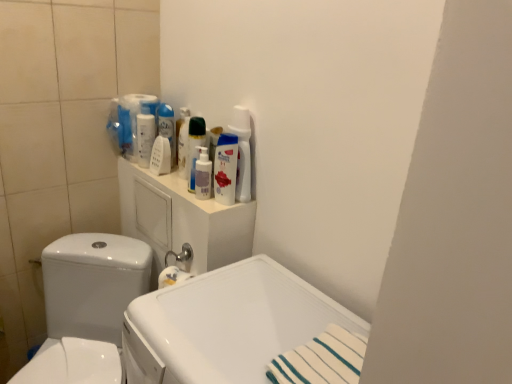
Describe the element at coordinates (194, 147) in the screenshot. I see `translucent plastic pump bottle at center, which is the 3th cleaning product from left to right` at that location.

Identify the location of white glossy bottle at upper center, acting as the fourth cleaning product starting from the left. This screenshot has height=384, width=512. (225, 168).

This screenshot has width=512, height=384. What do you see at coordinates (183, 147) in the screenshot?
I see `white glossy bottle at upper center, the 3th cleaning product viewed from the right` at bounding box center [183, 147].

Locate an element on the screen. The height and width of the screenshot is (384, 512). white glossy mouthwash at upper center, which appears as the second mouthwash when viewed from the front is located at coordinates (145, 138).

Based on the photo, is white glossy sink at center smaller than white plastic medicine cabinet at upper center?

No.

What's the angular difference between white glossy sink at center and white plastic medicine cabinet at upper center's facing directions?

They differ by 0.959 degrees in their facing directions.

Between point (180, 364) and point (165, 227), which one is positioned behind?

The point (165, 227) is behind.

Find the location of a particular element. This screenshot has height=384, width=512. sink that appears in front of the white plastic medicine cabinet at upper center is located at coordinates (226, 324).

Between semi-glossy white bottle at upper center, positioned as the second mouthwash in left-to-right order, and white glossy toilet at left, which one has smaller size?

semi-glossy white bottle at upper center, positioned as the second mouthwash in left-to-right order, is smaller.

From a real-world perspective, between semi-glossy white bottle at upper center, positioned as the second mouthwash in left-to-right order, and white glossy toilet at left, who is vertically lower?

white glossy toilet at left.

How much distance is there between semi-glossy white bottle at upper center, which appears as the 1th mouthwash when viewed from the right, and white glossy toilet at left?

A distance of 53.44 centimeters exists between semi-glossy white bottle at upper center, which appears as the 1th mouthwash when viewed from the right, and white glossy toilet at left.

Based on the photo, is semi-glossy white bottle at upper center, which appears as the 1th mouthwash when viewed from the right, thinner than white glossy toilet at left?

Yes, semi-glossy white bottle at upper center, which appears as the 1th mouthwash when viewed from the right, is thinner than white glossy toilet at left.

This screenshot has width=512, height=384. Identify the location of toilet that is on the left side of white glossy sink at center. pyautogui.click(x=87, y=306).

Considering the points (77, 298) and (262, 315), which point is behind, point (77, 298) or point (262, 315)?

The point (77, 298) is farther from the camera.

Is white glossy sink at center located within white glossy toilet at left?

Actually, white glossy sink at center is outside white glossy toilet at left.

Can you tell me how much white glossy toilet at left and white glossy bottle at upper center, acting as the 2th cleaning product starting from the left, differ in facing direction?

The angle between the facing direction of white glossy toilet at left and the facing direction of white glossy bottle at upper center, acting as the 2th cleaning product starting from the left, is 42.4 degrees.

Which object is positioned more to the right, white glossy toilet at left or white glossy bottle at upper center, acting as the 2th cleaning product starting from the left?

white glossy bottle at upper center, acting as the 2th cleaning product starting from the left, is more to the right.

From a real-world perspective, which object rests below the other?

white glossy toilet at left is physically lower.

Is white glossy toilet at left facing towards white glossy bottle at upper center, acting as the 2th cleaning product starting from the left?

No, white glossy toilet at left does not turn towards white glossy bottle at upper center, acting as the 2th cleaning product starting from the left.

From the picture: Which object is more forward, semi-glossy white bottle at upper center, which is the 2th mouthwash in back-to-front order, or white plastic medicine cabinet at upper center?

Positioned in front is white plastic medicine cabinet at upper center.

Would you say semi-glossy white bottle at upper center, the first mouthwash in the front-to-back sequence, is outside white plastic medicine cabinet at upper center?

Yes, semi-glossy white bottle at upper center, the first mouthwash in the front-to-back sequence, is not within white plastic medicine cabinet at upper center.

Is semi-glossy white bottle at upper center, positioned as the second mouthwash in left-to-right order, aimed at white plastic medicine cabinet at upper center?

No, semi-glossy white bottle at upper center, positioned as the second mouthwash in left-to-right order, is not turned towards white plastic medicine cabinet at upper center.

The image size is (512, 384). I want to click on mouthwash on the right of the white plastic medicine cabinet at upper center, so click(x=203, y=175).

From the image's perspective, who appears lower, white glossy spray bottle at upper center, which is the 4th cleaning product from right to left, or translucent plastic pump bottle at center, which appears as the 2th cleaning product when viewed from the right?

translucent plastic pump bottle at center, which appears as the 2th cleaning product when viewed from the right, from the image's perspective.

Based on the photo, is white glossy spray bottle at upper center, which is counted as the first cleaning product, starting from the left, located outside translucent plastic pump bottle at center, which is the 3th cleaning product from left to right?

white glossy spray bottle at upper center, which is counted as the first cleaning product, starting from the left, lies outside translucent plastic pump bottle at center, which is the 3th cleaning product from left to right,'s area.

Does white glossy spray bottle at upper center, which is counted as the first cleaning product, starting from the left, turn towards translucent plastic pump bottle at center, which appears as the 2th cleaning product when viewed from the right?

No.

Considering the positions of objects white glossy mouthwash at upper center, which is the first mouthwash in left-to-right order, and white glossy sink at center in the image provided, who is behind, white glossy mouthwash at upper center, which is the first mouthwash in left-to-right order, or white glossy sink at center?

white glossy mouthwash at upper center, which is the first mouthwash in left-to-right order, is more distant.

Can you confirm if white glossy mouthwash at upper center, marked as the second mouthwash in a right-to-left arrangement, is positioned to the right of white glossy sink at center?

Incorrect, white glossy mouthwash at upper center, marked as the second mouthwash in a right-to-left arrangement, is not on the right side of white glossy sink at center.

Is white glossy mouthwash at upper center, positioned as the 1th mouthwash in back-to-front order, outside of white glossy sink at center?

white glossy mouthwash at upper center, positioned as the 1th mouthwash in back-to-front order, is positioned outside white glossy sink at center.

In the scene shown: Which is nearer, (145, 129) or (344, 311)?

The point (344, 311) is more forward.

You are a GUI agent. You are given a task and a screenshot of the screen. Output one action in this format:
    pyautogui.click(x=<x>, y=<y>)
    Task: Click on the medicine cabinet directly beneath the white glossy sink at center (from a real-world perspective)
    
    Given the screenshot: What is the action you would take?
    [x=182, y=220]

Where is `toilet below the semi-glossy white bottle at upper center, the first mouthwash in the front-to-back sequence (from the image's perspective)`? The image size is (512, 384). toilet below the semi-glossy white bottle at upper center, the first mouthwash in the front-to-back sequence (from the image's perspective) is located at coordinates (87, 306).

When comparing their distances from white glossy toilet at left, does white glossy mouthwash at upper center, positioned as the 1th mouthwash in back-to-front order, or white glossy sink at center seem further?

white glossy mouthwash at upper center, positioned as the 1th mouthwash in back-to-front order, lies further to white glossy toilet at left than the other object.

Consider the image. Which object lies further to the anchor point white glossy spray bottle at upper center, which is the 4th cleaning product from right to left, semi-glossy white bottle at upper center, which is the 2th mouthwash in back-to-front order, or white glossy bottle at upper center, which is counted as the 1th cleaning product, starting from the right?

white glossy bottle at upper center, which is counted as the 1th cleaning product, starting from the right, is further to white glossy spray bottle at upper center, which is the 4th cleaning product from right to left.

Looking at the image, which one is located further to white glossy toilet at left, white glossy sink at center or semi-glossy white bottle at upper center, the first mouthwash in the front-to-back sequence?

Among the two, semi-glossy white bottle at upper center, the first mouthwash in the front-to-back sequence, is located further to white glossy toilet at left.

Estimate the real-world distances between objects in this image. Which object is closer to white glossy spray bottle at upper center, which is counted as the first cleaning product, starting from the left, white glossy bottle at upper center, the 3th cleaning product viewed from the right, or white glossy toilet at left?

The object closer to white glossy spray bottle at upper center, which is counted as the first cleaning product, starting from the left, is white glossy bottle at upper center, the 3th cleaning product viewed from the right.

Which object lies nearer to the anchor point semi-glossy white bottle at upper center, which appears as the 1th mouthwash when viewed from the right, white glossy toilet at left or white glossy mouthwash at upper center, which appears as the second mouthwash when viewed from the front?

Based on the image, white glossy mouthwash at upper center, which appears as the second mouthwash when viewed from the front, appears to be nearer to semi-glossy white bottle at upper center, which appears as the 1th mouthwash when viewed from the right.

From the image, which object appears to be farther from translucent plastic pump bottle at center, which is the 3th cleaning product from left to right, white glossy toilet at left or white glossy bottle at upper center, the 3th cleaning product viewed from the right?

white glossy toilet at left is further to translucent plastic pump bottle at center, which is the 3th cleaning product from left to right.

Looking at the image, which one is located closer to white glossy spray bottle at upper center, which is the 4th cleaning product from right to left, white plastic medicine cabinet at upper center or white glossy bottle at upper center, acting as the fourth cleaning product starting from the left?

white plastic medicine cabinet at upper center lies closer to white glossy spray bottle at upper center, which is the 4th cleaning product from right to left, than the other object.

From the image, which object appears to be nearer to semi-glossy white bottle at upper center, the first mouthwash in the front-to-back sequence, white glossy toilet at left or translucent plastic pump bottle at center, which appears as the 2th cleaning product when viewed from the right?

translucent plastic pump bottle at center, which appears as the 2th cleaning product when viewed from the right, is positioned closer to the anchor semi-glossy white bottle at upper center, the first mouthwash in the front-to-back sequence.

Identify the location of sink between white glossy bottle at upper center, which is counted as the 1th cleaning product, starting from the right, and white glossy toilet at left in the up-down direction. This screenshot has height=384, width=512. (226, 324).

Locate an element on the screen. mouthwash between white glossy mouthwash at upper center, which appears as the second mouthwash when viewed from the front, and white glossy toilet at left in the up-down direction is located at coordinates (203, 175).

Find the location of a particular element. cleaning product between semi-glossy white bottle at upper center, the first mouthwash in the front-to-back sequence, and white glossy bottle at upper center, the 3th cleaning product viewed from the right, from front to back is located at coordinates (194, 147).

Image resolution: width=512 pixels, height=384 pixels. I want to click on medicine cabinet between white glossy bottle at upper center, the 3th cleaning product viewed from the right, and white glossy sink at center in the up-down direction, so tap(182, 220).